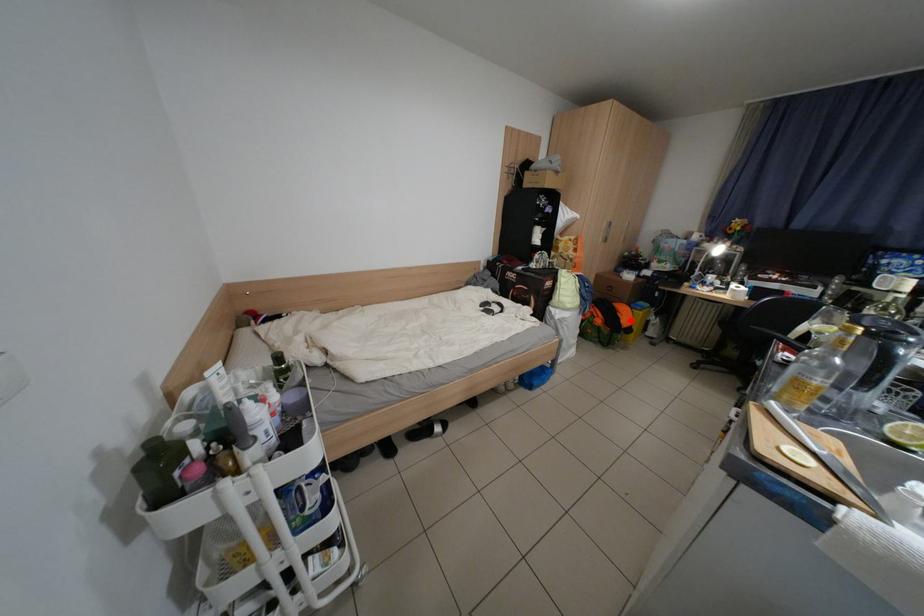
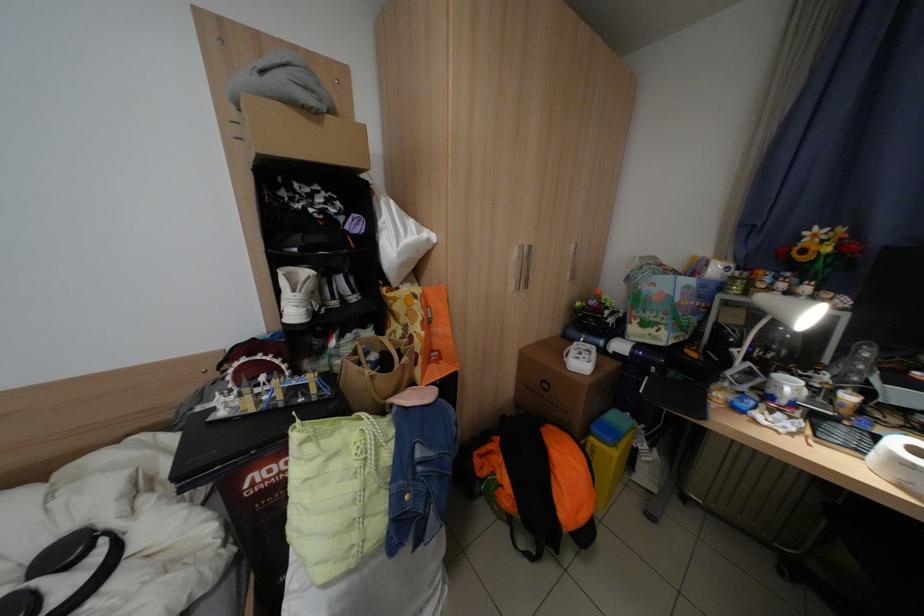
In the second image, find the point that corresponds to the highlighted location in the first image.

(565, 508)